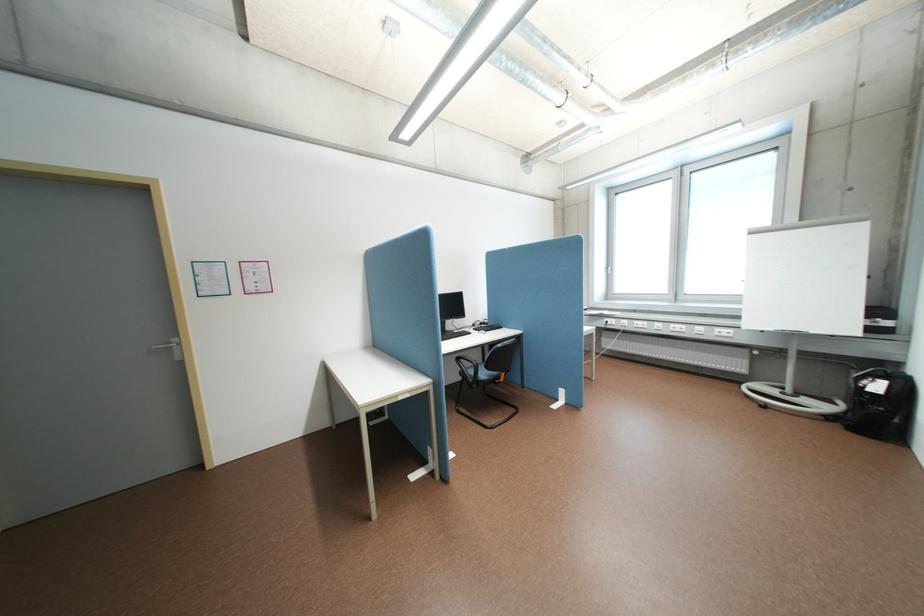
This screenshot has width=924, height=616. I want to click on silver door handle, so click(171, 347).